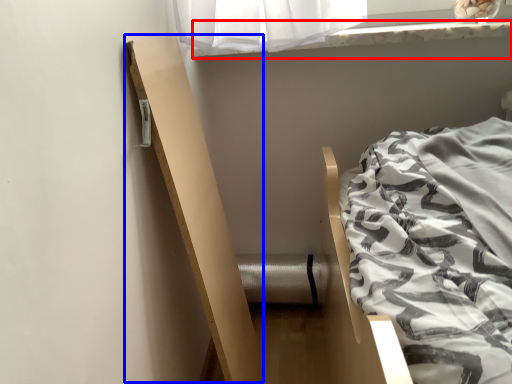
Question: Which object appears farthest to the camera in this image, window sill (highlighted by a red box) or balustrade (highlighted by a blue box)?

Choices:
 (A) window sill
 (B) balustrade

Answer: (A)